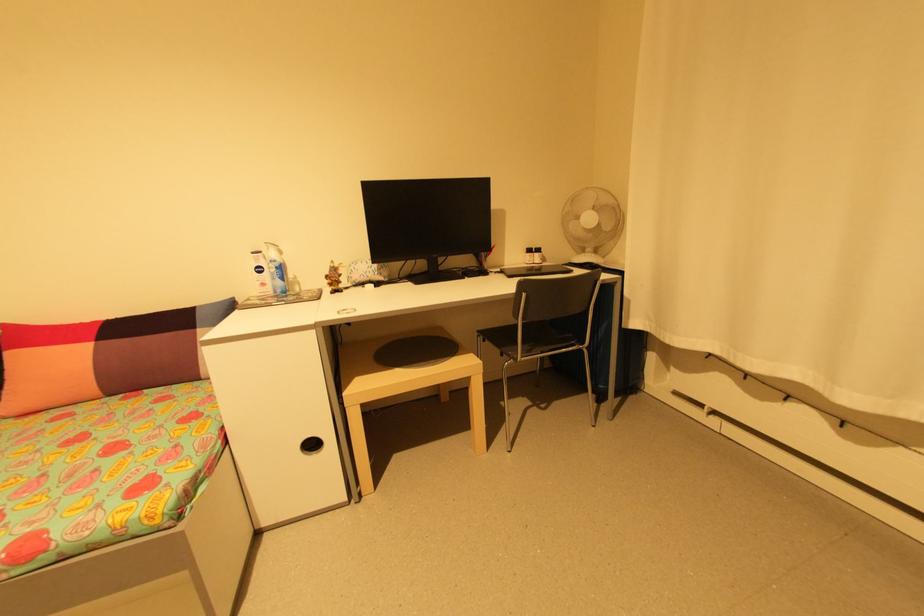
This screenshot has height=616, width=924. I want to click on sofa sitting surface, so click(101, 474).